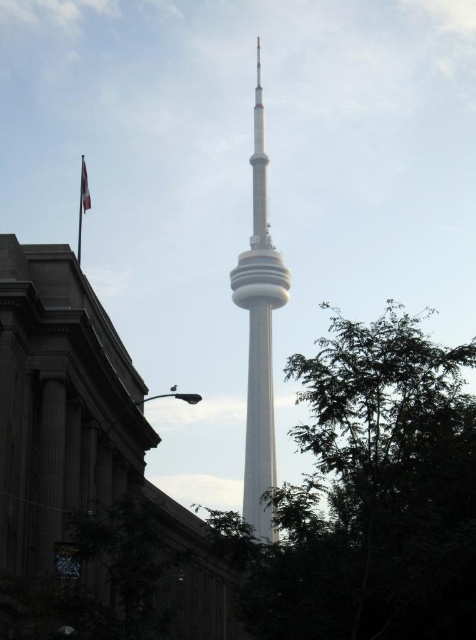
You are standing in front of the CN Tower and want to take a photo. There are two points marked in the scene. The first point is at coordinates point (269,374) and the second is at point (87,173). Which point is closer to you?

Point (87,173) is closer to you because it is in front of point (269,374).

You are a photographer planning to take a picture of the white smooth tower at center and the green leafy tree at center. You want to ensure that both objects are fully visible in the frame. Based on their widths, which object might require you to adjust your camera angle to avoid cropping?

The green leafy tree at center might be wider than the white smooth tower at center, so it might require adjusting the camera angle to ensure it fits fully in the frame without cropping.